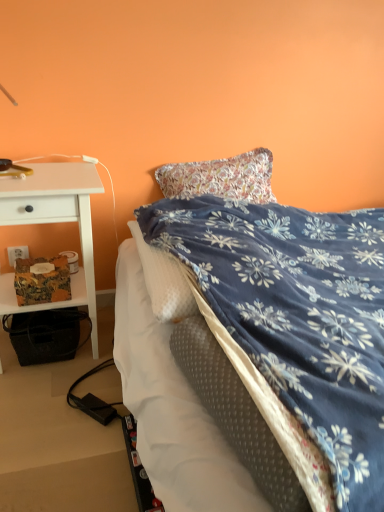
Question: Considering the relative positions of blue floral blanket at center and white plastic power outlet at lower left in the image provided, is blue floral blanket at center behind white plastic power outlet at lower left?

Choices:
 (A) yes
 (B) no

Answer: (B)

Question: From the image's perspective, would you say blue floral blanket at center is shown under white plastic power outlet at lower left?

Choices:
 (A) no
 (B) yes

Answer: (B)

Question: Is blue floral blanket at center smaller than white plastic power outlet at lower left?

Choices:
 (A) yes
 (B) no

Answer: (B)

Question: Does blue floral blanket at center come in front of white plastic power outlet at lower left?

Choices:
 (A) no
 (B) yes

Answer: (B)

Question: Can you confirm if blue floral blanket at center is bigger than white plastic power outlet at lower left?

Choices:
 (A) no
 (B) yes

Answer: (B)

Question: Is blue floral blanket at center completely or partially outside of white plastic power outlet at lower left?

Choices:
 (A) no
 (B) yes

Answer: (B)

Question: Does white plastic power outlet at lower left appear on the left side of white wood desk at left?

Choices:
 (A) yes
 (B) no

Answer: (A)

Question: Is white plastic power outlet at lower left taller than white wood desk at left?

Choices:
 (A) yes
 (B) no

Answer: (B)

Question: From a real-world perspective, is white plastic power outlet at lower left positioned under white wood desk at left based on gravity?

Choices:
 (A) no
 (B) yes

Answer: (B)

Question: Is white plastic power outlet at lower left behind white wood desk at left?

Choices:
 (A) no
 (B) yes

Answer: (B)

Question: From the image's perspective, does white plastic power outlet at lower left appear higher than white wood desk at left?

Choices:
 (A) no
 (B) yes

Answer: (B)

Question: From the image's perspective, is white plastic power outlet at lower left beneath white wood desk at left?

Choices:
 (A) no
 (B) yes

Answer: (A)

Question: Does white plastic power outlet at lower left turn towards blue floral blanket at center?

Choices:
 (A) yes
 (B) no

Answer: (B)